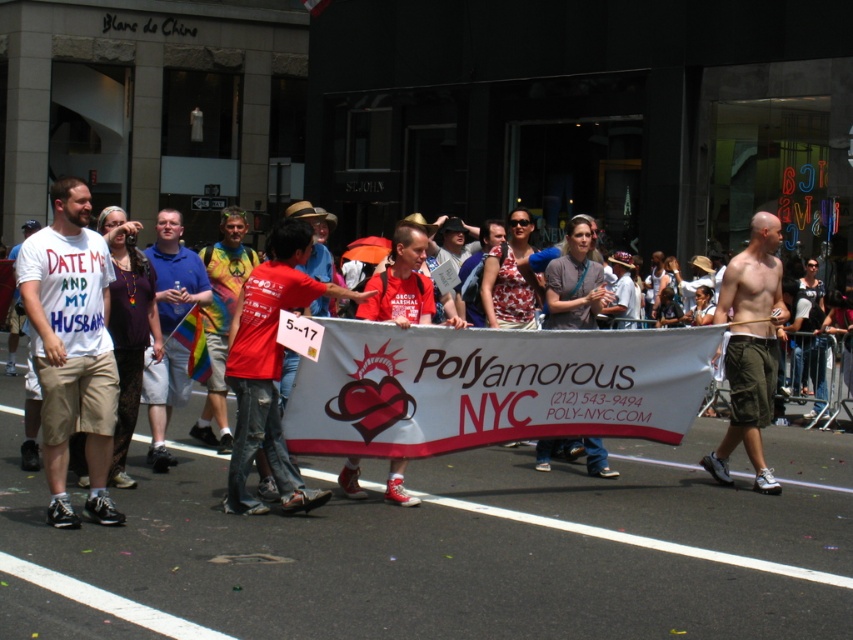
Does point (297, 480) lie in front of point (764, 385)?

Yes, point (297, 480) is in front of point (764, 385).

From the picture: Is the position of red cotton shirt at center less distant than that of shiny khaki shorts at right?

Yes, red cotton shirt at center is in front of shiny khaki shorts at right.

Describe the element at coordinates (270, 368) in the screenshot. This screenshot has width=853, height=640. I see `red cotton shirt at center` at that location.

Where is `red cotton shirt at center`? This screenshot has height=640, width=853. red cotton shirt at center is located at coordinates (270, 368).

Is white banner at center positioned before red cotton shirt at center?

No, white banner at center is further to the viewer.

Can you confirm if white banner at center is positioned to the left of red cotton shirt at center?

No, white banner at center is not to the left of red cotton shirt at center.

Who is more forward, (572,396) or (262,394)?

Point (262,394)

The height and width of the screenshot is (640, 853). In order to click on white banner at center in this screenshot , I will do `click(560, 396)`.

Locate an element on the screen. white cotton t-shirt at left is located at coordinates (73, 348).

Is white cotton t-shirt at left closer to camera compared to red cotton shirt at center?

Yes, it is in front of red cotton shirt at center.

Locate an element on the screen. white cotton t-shirt at left is located at coordinates (73, 348).

Find the location of a particular element. This screenshot has width=853, height=640. white cotton t-shirt at left is located at coordinates (73, 348).